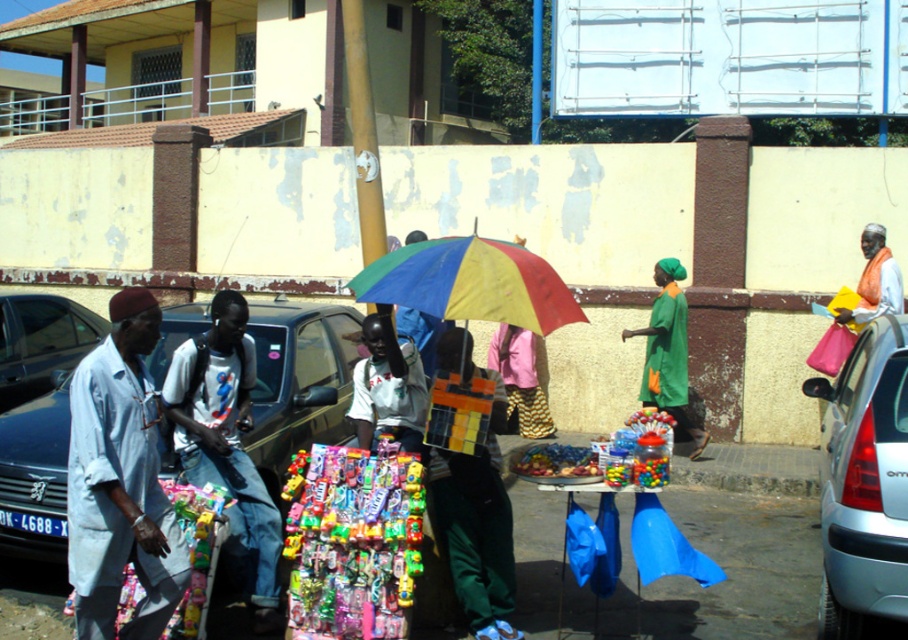
You are a photographer standing in the middle of the street. You notice a light blue fabric shirt at left and a shiny black car at left. Which object is taller from your perspective?

The light blue fabric shirt at left is much taller than the shiny black car at left.

You are a delivery person trying to park your van in the space between the silver metallic car at right and the shiny black car at left. According to the scene description, can you safely park there without blocking either vehicle?

The silver metallic car at right is positioned under the shiny black car at left, which suggests they are parked one behind the other rather than side by side. Therefore, there is no space between them for your van to park without blocking either vehicle.